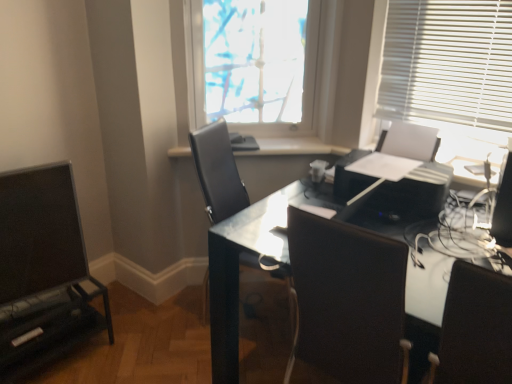
Question: Does translucent fabric at upper center have a smaller size compared to glossy black desk at center?

Choices:
 (A) yes
 (B) no

Answer: (A)

Question: Is translucent fabric at upper center touching glossy black desk at center?

Choices:
 (A) yes
 (B) no

Answer: (B)

Question: Is translucent fabric at upper center located outside glossy black desk at center?

Choices:
 (A) yes
 (B) no

Answer: (A)

Question: Is translucent fabric at upper center at the left side of glossy black desk at center?

Choices:
 (A) yes
 (B) no

Answer: (A)

Question: Is the position of translucent fabric at upper center more distant than that of glossy black desk at center?

Choices:
 (A) yes
 (B) no

Answer: (A)

Question: From a real-world perspective, relative to black leather chair at right, the first chair when ordered from front to back, is matte black entertainment center at left vertically above or below?

Choices:
 (A) above
 (B) below

Answer: (B)

Question: Is matte black entertainment center at left wider or thinner than black leather chair at right, positioned as the 2th chair in left-to-right order?

Choices:
 (A) wide
 (B) thin

Answer: (B)

Question: Is matte black entertainment center at left situated inside black leather chair at right, the first chair when ordered from front to back, or outside?

Choices:
 (A) outside
 (B) inside

Answer: (A)

Question: Considering the positions of matte black entertainment center at left and black leather chair at right, the 1th chair viewed from the right, in the image, is matte black entertainment center at left bigger or smaller than black leather chair at right, the 1th chair viewed from the right,?

Choices:
 (A) big
 (B) small

Answer: (B)

Question: Looking at the image, does white glossy window sill at center seem bigger or smaller compared to black leather chair at center, positioned as the first chair in left-to-right order?

Choices:
 (A) big
 (B) small

Answer: (B)

Question: Is point (267, 139) positioned closer to the camera than point (224, 163)?

Choices:
 (A) farther
 (B) closer

Answer: (A)

Question: Do you think white glossy window sill at center is within black leather chair at center, positioned as the first chair in back-to-front order, or outside of it?

Choices:
 (A) inside
 (B) outside

Answer: (B)

Question: From a real-world perspective, is white glossy window sill at center positioned above or below black leather chair at center, the second chair in the right-to-left sequence?

Choices:
 (A) below
 (B) above

Answer: (B)

Question: Is black plastic printer at center wider or thinner than white glossy window sill at center?

Choices:
 (A) thin
 (B) wide

Answer: (B)

Question: Is black plastic printer at center taller or shorter than white glossy window sill at center?

Choices:
 (A) tall
 (B) short

Answer: (A)